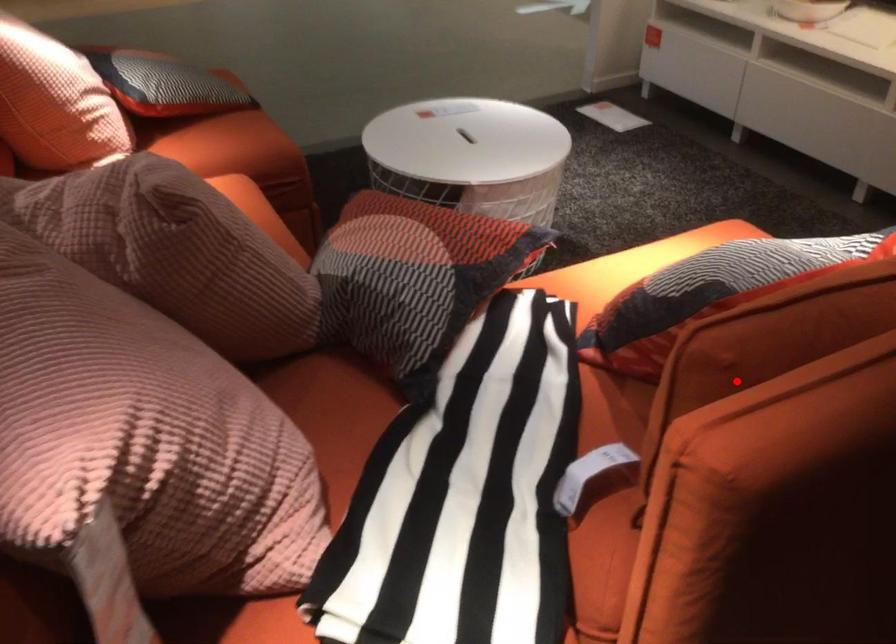
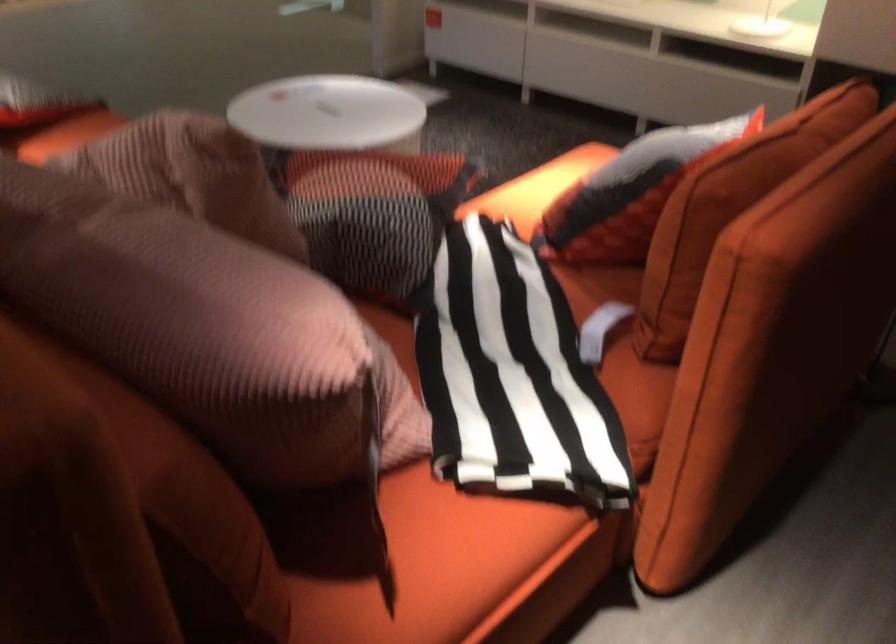
Question: I am providing you with two images of the same scene from different viewpoints. In image1, a red point is highlighted. Considering the same 3D point in image2, which of the following is correct?

Choices:
 (A) It is closer
 (B) It is farther

Answer: (B)